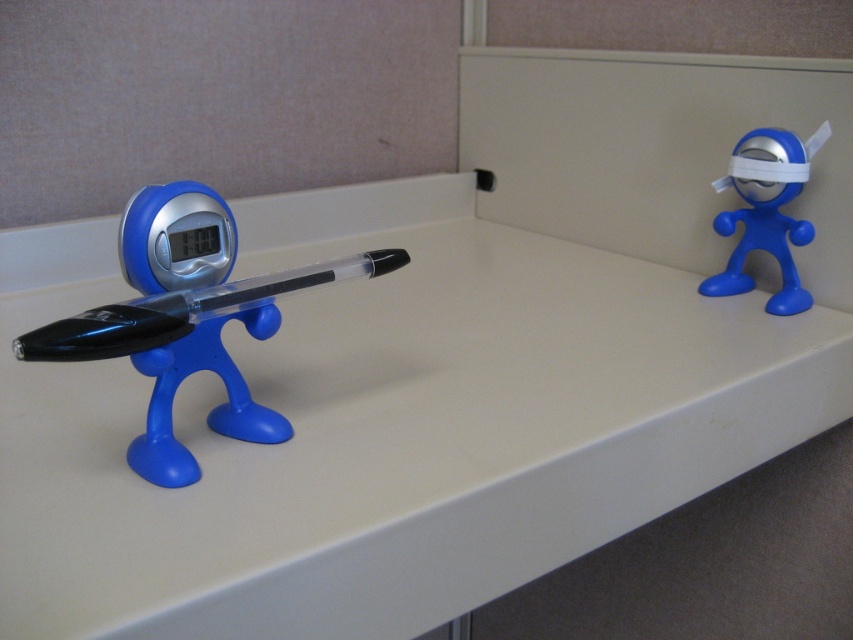
Does transparent plastic pen at left appear over blue matte toy at right?

Incorrect, transparent plastic pen at left is not positioned above blue matte toy at right.

Does point (181, 292) come farther from viewer compared to point (759, 228)?

No, it is in front of (759, 228).

Does point (207, 314) lie in front of point (767, 177)?

Yes, point (207, 314) is in front of point (767, 177).

Identify the location of transparent plastic pen at left. The width and height of the screenshot is (853, 640). (183, 310).

Which is more to the right, white matte counter top at center or transparent plastic pen at left?

white matte counter top at center is more to the right.

Measure the distance from white matte counter top at center to transparent plastic pen at left.

white matte counter top at center and transparent plastic pen at left are 11.02 inches apart from each other.

Is point (587, 284) positioned in front of point (231, 284)?

No, it is behind (231, 284).

The width and height of the screenshot is (853, 640). In order to click on white matte counter top at center in this screenshot , I will do `click(384, 428)`.

Can you confirm if matte plastic pen holder at left is smaller than transparent plastic pen at left?

Actually, matte plastic pen holder at left might be larger than transparent plastic pen at left.

The image size is (853, 640). Identify the location of matte plastic pen holder at left. (186, 317).

Find the location of a particular element. The image size is (853, 640). matte plastic pen holder at left is located at coordinates (186, 317).